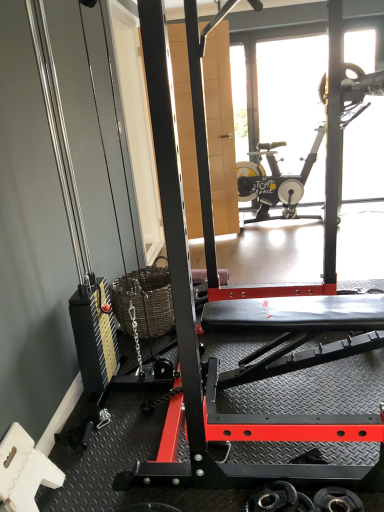
Question: Is transparent glass door at upper center taller or shorter than metallic black weight at lower center, acting as the 1th wheel starting from the left?

Choices:
 (A) tall
 (B) short

Answer: (A)

Question: Do you think transparent glass door at upper center is within metallic black weight at lower center, the 2th wheel in the right-to-left sequence, or outside of it?

Choices:
 (A) inside
 (B) outside

Answer: (B)

Question: Which is farther from the metallic black weight at lower center, acting as the 1th wheel starting from the left?

Choices:
 (A) transparent glass door at upper center
 (B) black rubber weight at lower right, arranged as the first wheel when viewed from the right

Answer: (A)

Question: Considering the real-world distances, which object is farthest from the transparent glass door at upper center?

Choices:
 (A) black rubber weight at lower right, arranged as the first wheel when viewed from the right
 (B) metallic black weight at lower center, the 2th wheel in the right-to-left sequence

Answer: (A)